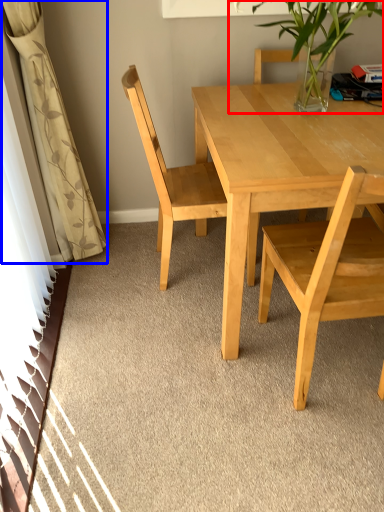
Question: Which object is closer to the camera taking this photo, houseplant (highlighted by a red box) or curtain (highlighted by a blue box)?

Choices:
 (A) houseplant
 (B) curtain

Answer: (A)